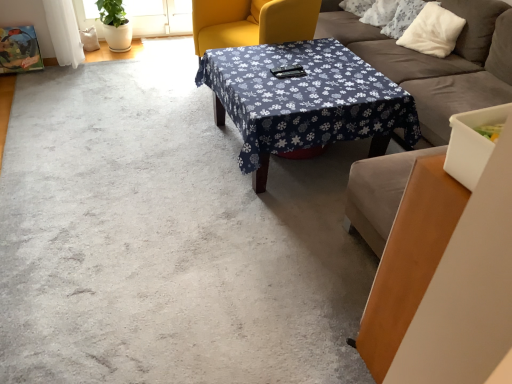
Question: Considering the relative sizes of soft gray fabric couch at center and white fluffy pillow at upper right in the image provided, is soft gray fabric couch at center smaller than white fluffy pillow at upper right?

Choices:
 (A) yes
 (B) no

Answer: (B)

Question: From a real-world perspective, is soft gray fabric couch at center physically below white fluffy pillow at upper right?

Choices:
 (A) yes
 (B) no

Answer: (A)

Question: Is soft gray fabric couch at center at the right side of white fluffy pillow at upper right?

Choices:
 (A) yes
 (B) no

Answer: (B)

Question: Are soft gray fabric couch at center and white fluffy pillow at upper right far apart?

Choices:
 (A) yes
 (B) no

Answer: (B)

Question: Could you tell me if soft gray fabric couch at center is facing white fluffy pillow at upper right?

Choices:
 (A) yes
 (B) no

Answer: (A)

Question: Considering the relative positions of soft gray fabric couch at center and white fluffy pillow at upper right in the image provided, is soft gray fabric couch at center in front of white fluffy pillow at upper right?

Choices:
 (A) yes
 (B) no

Answer: (A)

Question: Is white fluffy pillow at upper right next to blue fabric-covered table at center and touching it?

Choices:
 (A) no
 (B) yes

Answer: (A)

Question: Does white fluffy pillow at upper right come in front of blue fabric-covered table at center?

Choices:
 (A) yes
 (B) no

Answer: (B)

Question: Is white fluffy pillow at upper right outside of blue fabric-covered table at center?

Choices:
 (A) yes
 (B) no

Answer: (A)

Question: Considering the relative sizes of white fluffy pillow at upper right and blue fabric-covered table at center in the image provided, is white fluffy pillow at upper right taller than blue fabric-covered table at center?

Choices:
 (A) yes
 (B) no

Answer: (A)

Question: Can you confirm if white fluffy pillow at upper right is thinner than blue fabric-covered table at center?

Choices:
 (A) yes
 (B) no

Answer: (A)

Question: Does white fluffy pillow at upper right turn towards blue fabric-covered table at center?

Choices:
 (A) no
 (B) yes

Answer: (B)

Question: Does matte yellow swivel chair at center lie in front of white fluffy pillow at upper right?

Choices:
 (A) yes
 (B) no

Answer: (A)